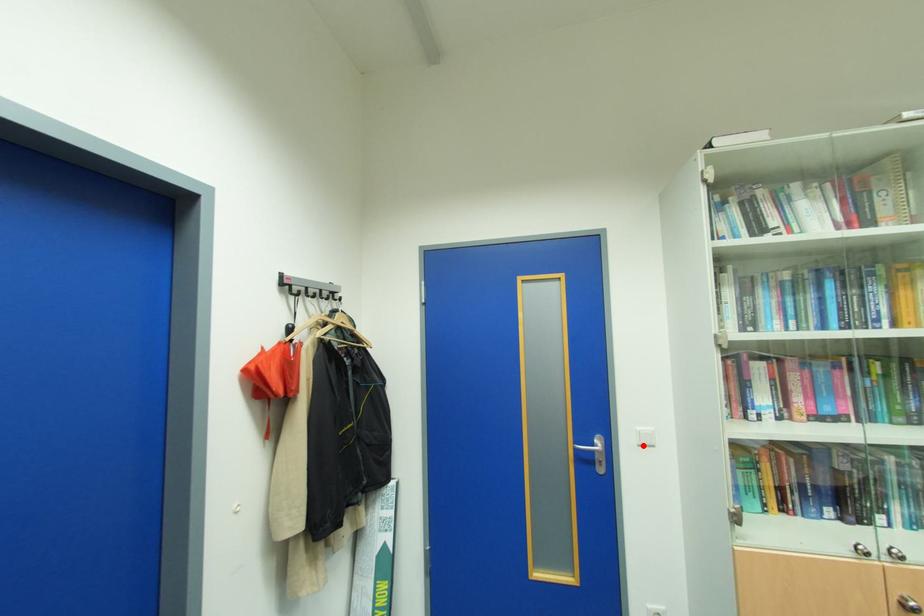
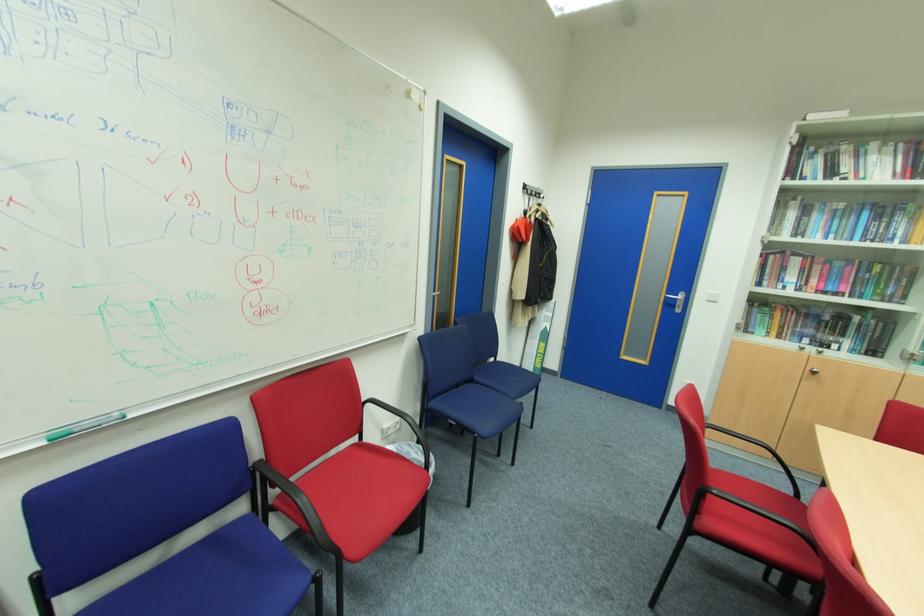
Find the pixel in the second image that matches the highlighted location in the first image.

(711, 301)